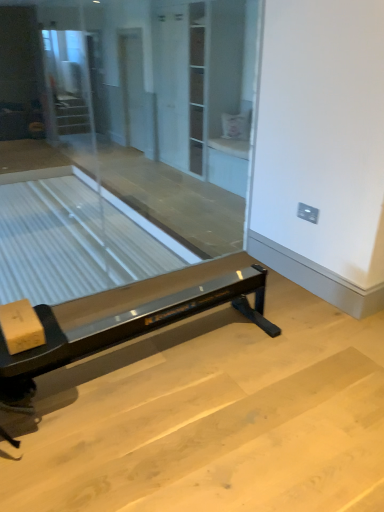
Question: From a real-world perspective, is clear glass table at left positioned above or below transparent glass screen door at center?

Choices:
 (A) below
 (B) above

Answer: (A)

Question: Looking at their shapes, would you say clear glass table at left is wider or thinner than transparent glass screen door at center?

Choices:
 (A) wide
 (B) thin

Answer: (A)

Question: Which of these objects is positioned closest to the clear glass table at left?

Choices:
 (A) transparent glass screen door at center
 (B) black glossy rowing machine at center

Answer: (A)

Question: Based on their relative distances, which object is nearer to the transparent glass screen door at center?

Choices:
 (A) clear glass table at left
 (B) black glossy rowing machine at center

Answer: (A)